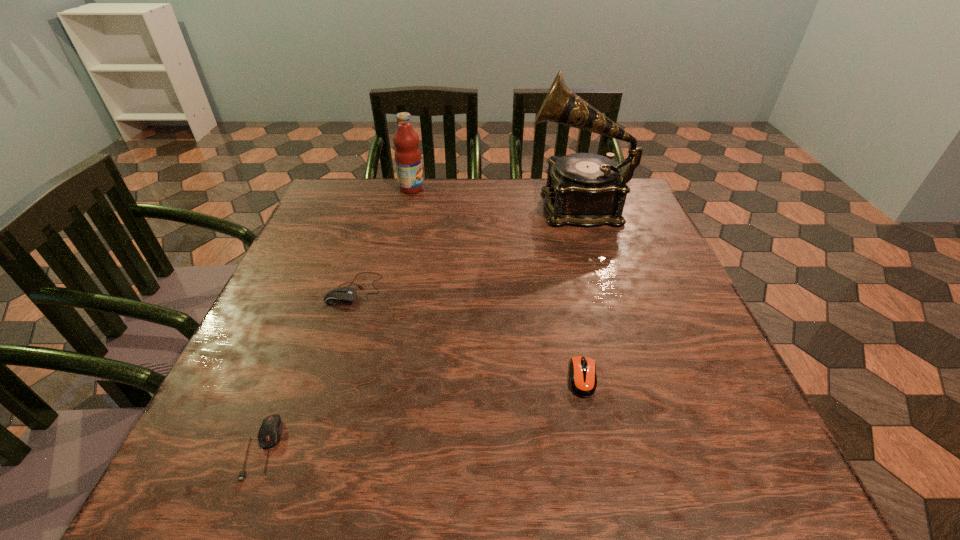
At what (x,y) coordinates should I click in order to perform the action: click on vacant area that lies between the phonograph record and the nearest object. Please return your answer as a coordinate pair (x, y). Image resolution: width=960 pixels, height=540 pixels. Looking at the image, I should click on (420, 326).

Where is `vacant region between the farthest mouse and the fruit juice`? vacant region between the farthest mouse and the fruit juice is located at coordinates (383, 239).

The width and height of the screenshot is (960, 540). In order to click on vacant space that's between the second nearest mouse and the phonograph record in this screenshot , I will do `click(581, 292)`.

At what (x,y) coordinates should I click in order to perform the action: click on vacant region between the fourth farthest object and the nearest mouse. Please return your answer as a coordinate pair (x, y). Looking at the image, I should click on (423, 413).

Where is `free space between the farthest mouse and the rightmost mouse`? free space between the farthest mouse and the rightmost mouse is located at coordinates (468, 333).

Locate which object ranks fourth in proximity to the nearest object. Please provide its 2D coordinates. Your answer should be formatted as a tuple, i.e. [(x, y)], where the tuple contains the x and y coordinates of a point satisfying the conditions above.

[(407, 154)]

Select which object is the second closest to the fruit juice. Please provide its 2D coordinates. Your answer should be formatted as a tuple, i.e. [(x, y)], where the tuple contains the x and y coordinates of a point satisfying the conditions above.

[(344, 295)]

The width and height of the screenshot is (960, 540). Identify the location of mouse identified as the second closest to the fruit juice. (583, 382).

Locate which mouse is the closest to the fourth shortest object. Please provide its 2D coordinates. Your answer should be formatted as a tuple, i.e. [(x, y)], where the tuple contains the x and y coordinates of a point satisfying the conditions above.

[(344, 295)]

Identify the location of vacant region that satisfies the following two spatial constraints: 1. on the front label of the fruit juice; 2. on the front side of the nearest mouse. (351, 448).